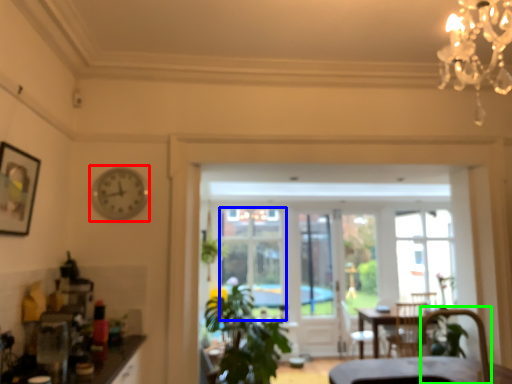
Question: Based on their relative distances, which object is farther from clock (highlighted by a red box)? Choose from window (highlighted by a blue box) and armchair (highlighted by a green box).

Choices:
 (A) window
 (B) armchair

Answer: (A)